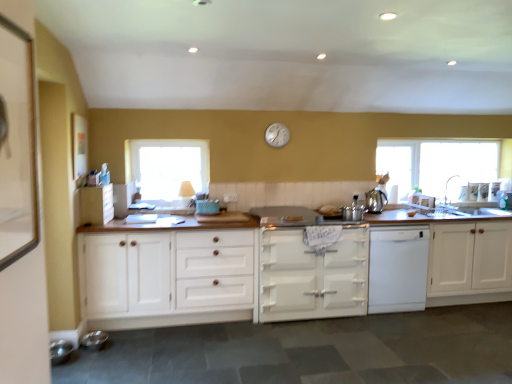
This screenshot has width=512, height=384. I want to click on empty space that is ontop of metallic stainless steel bowls at lower left, the 1th appliance positioned from the front (from a real-world perspective), so click(x=59, y=341).